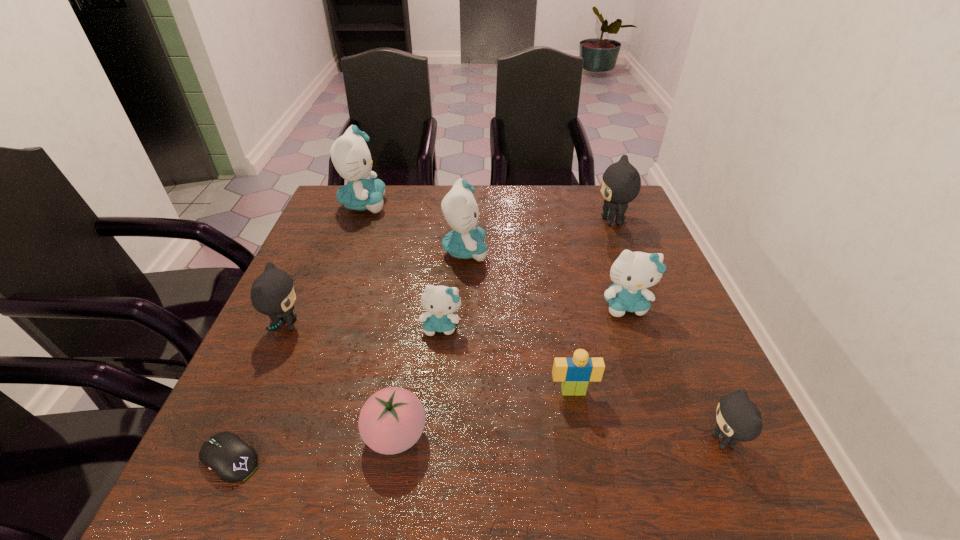
You are a GUI agent. You are given a task and a screenshot of the screen. Output one action in this format:
    pyautogui.click(x=<x>, y=<y>)
    Task: Click on the gray kitten that is the second closest to the biggest gray kitten
    The height and width of the screenshot is (540, 960).
    Given the screenshot: What is the action you would take?
    pyautogui.click(x=273, y=293)

Find the location of a particular element. The width and height of the screenshot is (960, 540). vacant space that satisfies the following two spatial constraints: 1. on the face of the biggest blue kitten; 2. on the left side of the tomato is located at coordinates (277, 435).

Find the location of a particular element. blank space that satisfies the following two spatial constraints: 1. on the face of the rightmost blue kitten; 2. on the front-facing side of the leftmost gray kitten is located at coordinates 632,325.

At what (x,y) coordinates should I click in order to perform the action: click on vacant space that satisfies the following two spatial constraints: 1. on the face of the tallest kitten; 2. on the back side of the red tomato. Please return your answer as a coordinate pair (x, y). The height and width of the screenshot is (540, 960). Looking at the image, I should click on (277, 435).

You are a GUI agent. You are given a task and a screenshot of the screen. Output one action in this format:
    pyautogui.click(x=<x>, y=<y>)
    Task: Click on the vacant space that satisfies the following two spatial constraints: 1. on the front-facing side of the farthest gray kitten; 2. on the face of the seventh object from left to right
    
    Given the screenshot: What is the action you would take?
    pyautogui.click(x=681, y=391)